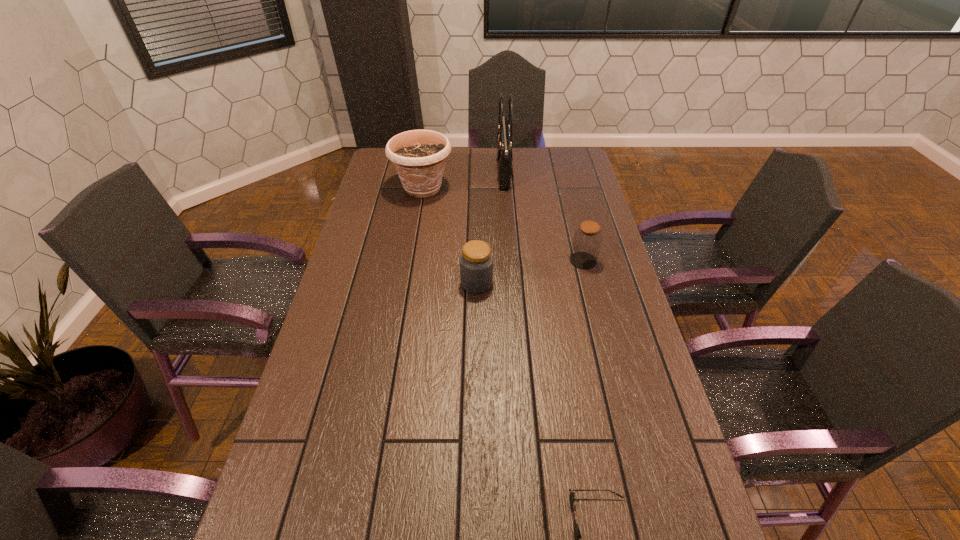
At what (x,y) coordinates should I click in order to perform the action: click on jar that is the second closest to the tallest object. Please return your answer as a coordinate pair (x, y). This screenshot has height=540, width=960. Looking at the image, I should click on (476, 261).